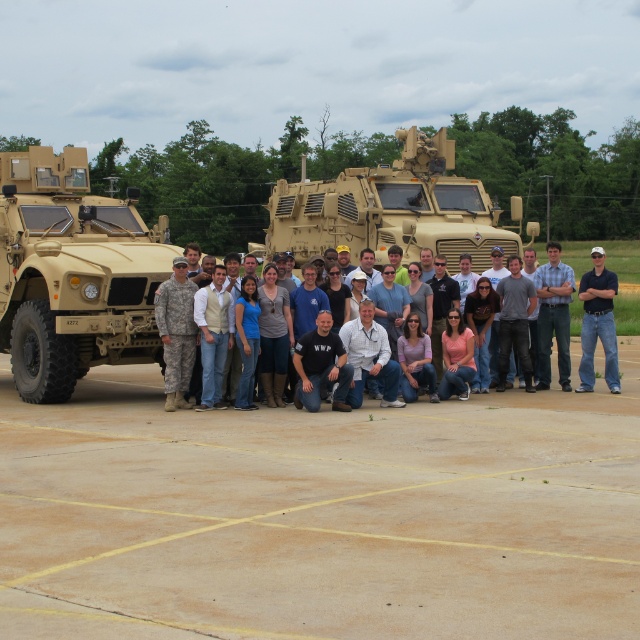
You are a photographer taking a picture of the camouflage fabric armored vehicle at center and the blue shirt at center. Which object is positioned higher in the image?

The camouflage fabric armored vehicle at center is above the blue shirt at center, so it is positioned higher in the image.